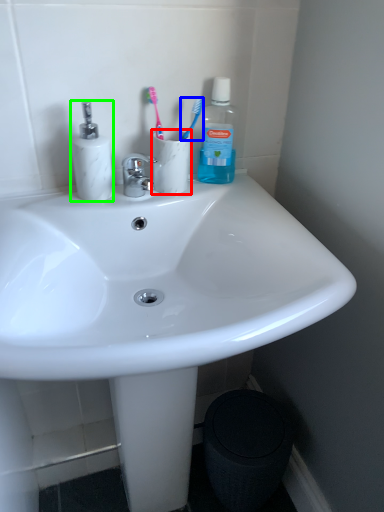
Question: Considering the real-world distances, which object is farthest from coffee cup (highlighted by a red box)? toothbrush (highlighted by a blue box) or toiletries (highlighted by a green box)?

Choices:
 (A) toothbrush
 (B) toiletries

Answer: (B)